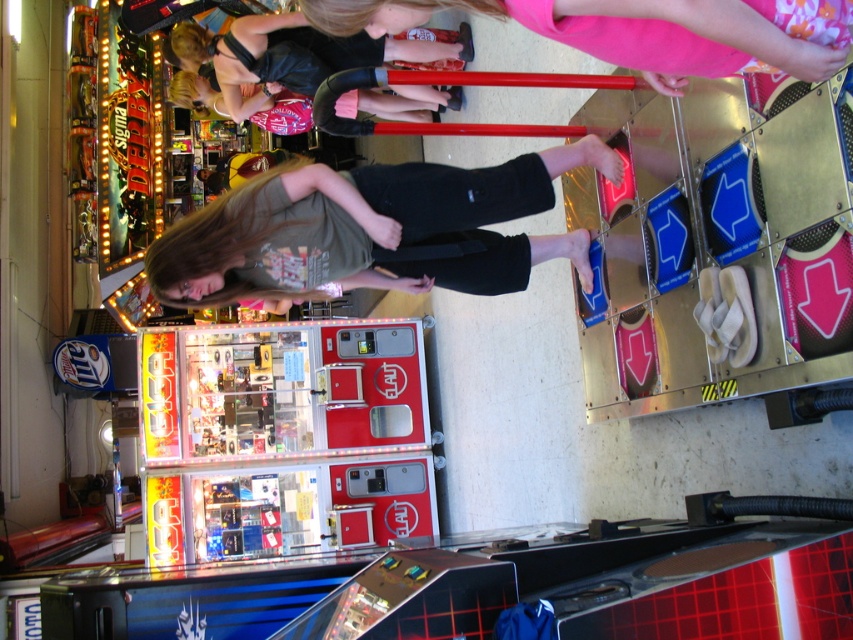
Question: Does green cotton shirt at center have a lesser width compared to black leather jacket at upper center?

Choices:
 (A) no
 (B) yes

Answer: (B)

Question: Which of the following is the closest to the observer?

Choices:
 (A) green cotton shirt at center
 (B) matte black pants at center
 (C) black leather jacket at upper center

Answer: (B)

Question: Is green cotton shirt at center to the right of black leather jacket at upper center from the viewer's perspective?

Choices:
 (A) no
 (B) yes

Answer: (B)

Question: Which object appears closest to the camera in this image?

Choices:
 (A) matte black pants at center
 (B) green cotton shirt at center
 (C) black leather jacket at upper center

Answer: (A)

Question: From the image, what is the correct spatial relationship of green cotton shirt at center in relation to black leather jacket at upper center?

Choices:
 (A) right
 (B) left

Answer: (A)

Question: Which of the following is the closest to the observer?

Choices:
 (A) green cotton shirt at center
 (B) matte black pants at center

Answer: (B)